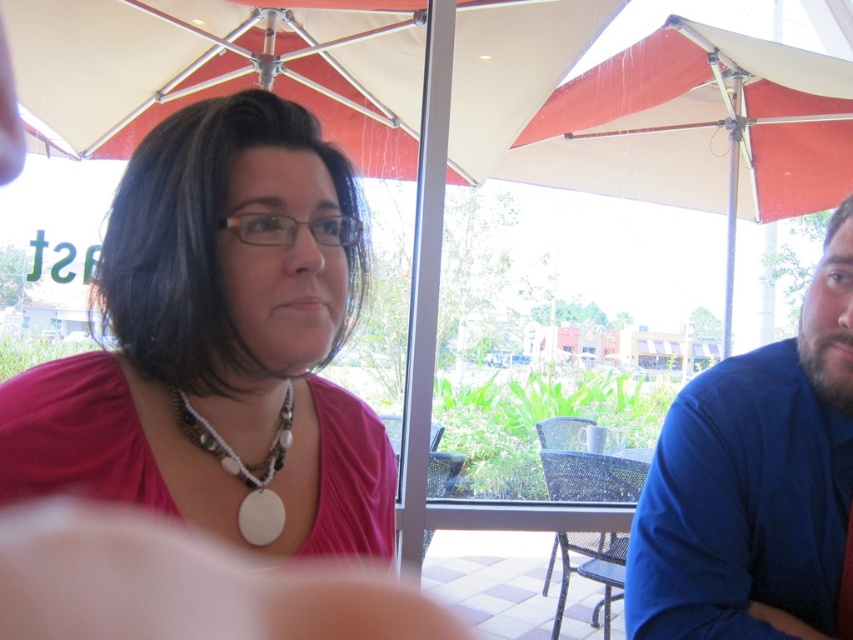
You are standing at the point with coordinates point (138,61) and want to walk towards the point with coordinates point (125,401). Which direction should you move?

You should move forward because point (125,401) is in front of point (138,61).

From the picture: You are a photographer trying to capture a photo of the blue fabric shirt at right without including the white fabric umbrella at upper center in the frame. Based on their positions, is this possible?

The white fabric umbrella at upper center is to the left of the blue fabric shirt at right, so you can position your camera to the right side of the blue fabric shirt at right to exclude the umbrella from the frame.

Consider the image. You are a tailor measuring fabrics for a new project. You observe the pink fabric shirt at center and the white fabric umbrella at upper center in the image. Which item requires a smaller amount of fabric to create?

The pink fabric shirt at center requires a smaller amount of fabric to create because its width is less than that of the white fabric umbrella at upper center.